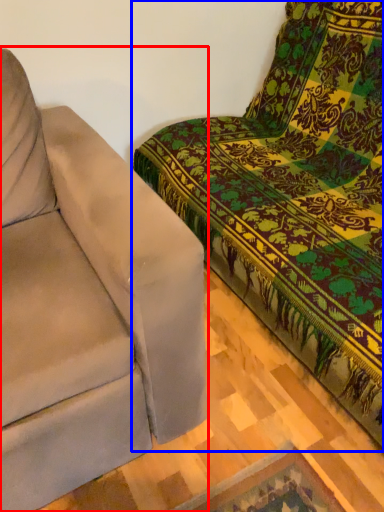
Question: Which of the following is the farthest to the observer, studio couch (highlighted by a red box) or studio couch (highlighted by a blue box)?

Choices:
 (A) studio couch
 (B) studio couch

Answer: (A)